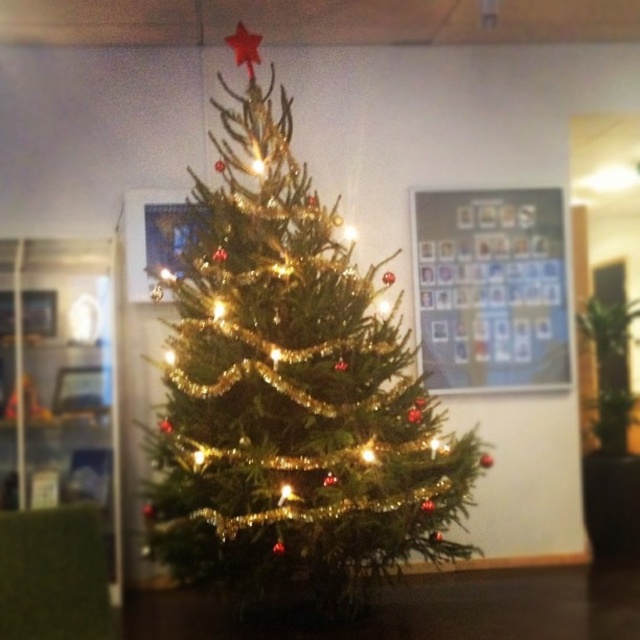
Does green shiny christmas tree at center appear on the right side of metallic red star at top?

Indeed, green shiny christmas tree at center is positioned on the right side of metallic red star at top.

Is point (300, 529) more distant than point (253, 44)?

No, it is in front of (253, 44).

Locate an element on the screen. green shiny christmas tree at center is located at coordinates (291, 396).

Is metallic silver frame at upper center shorter than metallic red star at top?

No, metallic silver frame at upper center is not shorter than metallic red star at top.

Is metallic silver frame at upper center wider than metallic red star at top?

Correct, the width of metallic silver frame at upper center exceeds that of metallic red star at top.

Between point (552, 337) and point (253, 58), which one is positioned behind?

The point (552, 337) is more distant.

The height and width of the screenshot is (640, 640). Identify the location of metallic silver frame at upper center. (492, 289).

I want to click on green shiny christmas tree at center, so click(291, 396).

Can you confirm if green shiny christmas tree at center is positioned below metallic silver frame at upper center?

Indeed, green shiny christmas tree at center is positioned under metallic silver frame at upper center.

Where is `green shiny christmas tree at center`? The width and height of the screenshot is (640, 640). green shiny christmas tree at center is located at coordinates (291, 396).